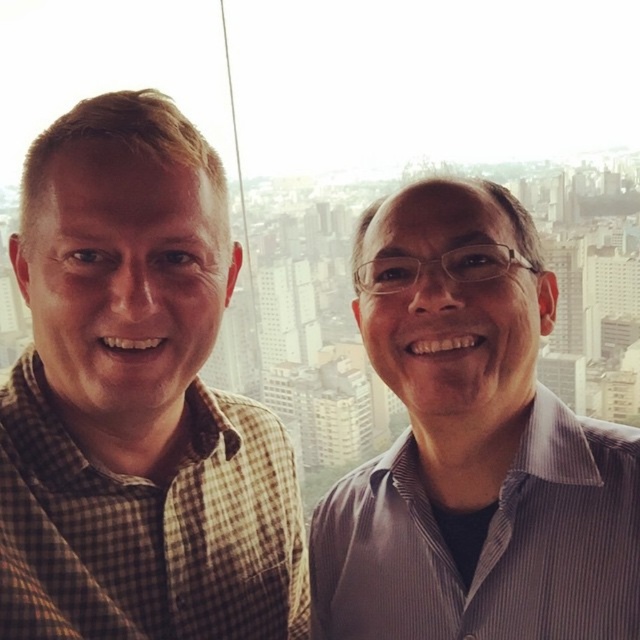
Question: Which point is closer to the camera?

Choices:
 (A) brown checkered shirt at left
 (B) striped shirt at center

Answer: (A)

Question: Which object appears farthest from the camera in this image?

Choices:
 (A) brown checkered shirt at left
 (B) striped shirt at center

Answer: (B)

Question: Is brown checkered shirt at left to the right of striped shirt at center from the viewer's perspective?

Choices:
 (A) yes
 (B) no

Answer: (B)

Question: Is brown checkered shirt at left below striped shirt at center?

Choices:
 (A) no
 (B) yes

Answer: (A)

Question: From the image, what is the correct spatial relationship of brown checkered shirt at left in relation to striped shirt at center?

Choices:
 (A) below
 (B) above

Answer: (B)